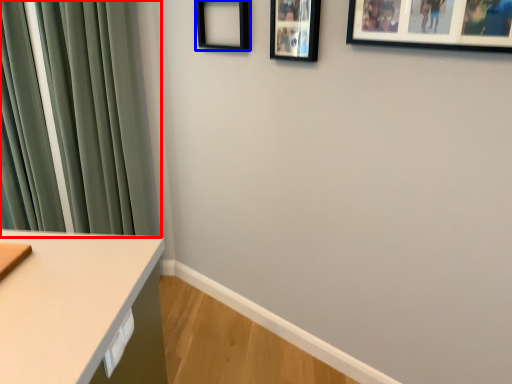
Question: Which object appears farthest to the camera in this image, curtain (highlighted by a red box) or picture frame (highlighted by a blue box)?

Choices:
 (A) curtain
 (B) picture frame

Answer: (A)